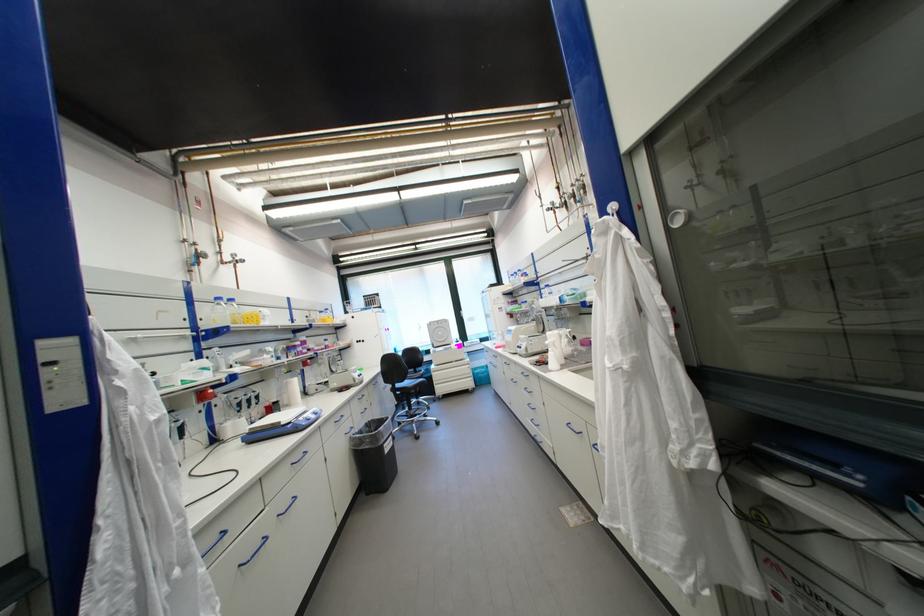
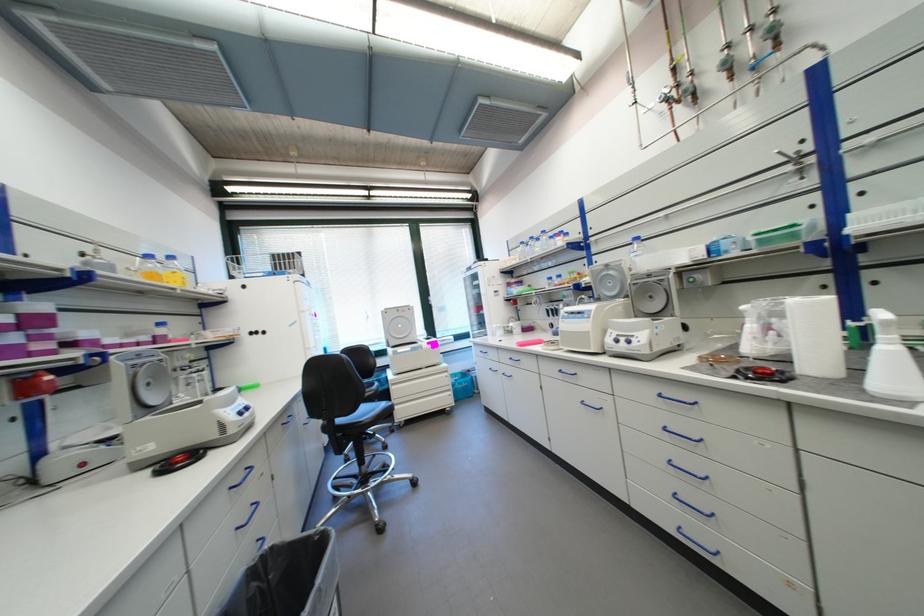
In a continuous first-person perspective shot, in which direction is the camera moving?

The movement direction of the cameraman is left, forward.